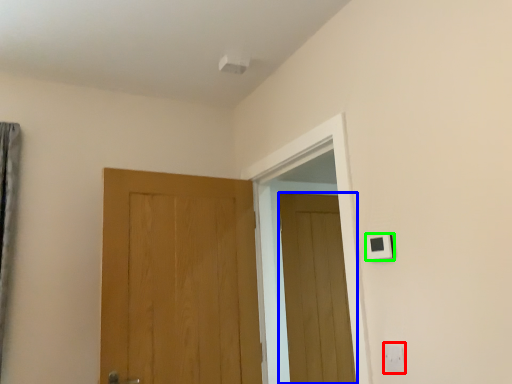
Question: Which object is the farthest from electric outlet (highlighted by a red box)? Choose among these: door (highlighted by a blue box) or light switch (highlighted by a green box).

Choices:
 (A) door
 (B) light switch

Answer: (A)